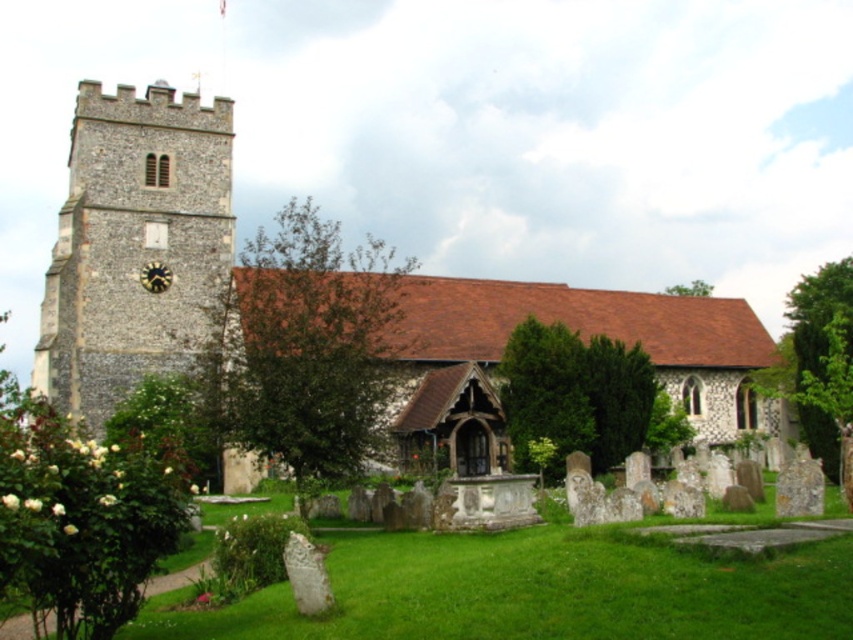
Does green textured tree at center appear on the left side of gold metallic clock at upper left?

No, green textured tree at center is not to the left of gold metallic clock at upper left.

Measure the distance between green textured tree at center and camera.

A distance of 68.93 meters exists between green textured tree at center and camera.

In order to click on green textured tree at center in this screenshot , I will do `click(573, 394)`.

Is stone clock tower at left thinner than green leafy bush at lower left?

Yes.

Does stone clock tower at left have a greater width compared to green leafy bush at lower left?

In fact, stone clock tower at left might be narrower than green leafy bush at lower left.

Locate an element on the screen. stone clock tower at left is located at coordinates (134, 244).

Which is above, green textured tree at center or green leafy tree at right?

Positioned higher is green leafy tree at right.

Looking at this image, does green textured tree at center have a lesser height compared to green leafy tree at right?

Yes, green textured tree at center is shorter than green leafy tree at right.

The width and height of the screenshot is (853, 640). What do you see at coordinates (573, 394) in the screenshot?
I see `green textured tree at center` at bounding box center [573, 394].

Find the location of a particular element. Image resolution: width=853 pixels, height=640 pixels. green textured tree at center is located at coordinates (573, 394).